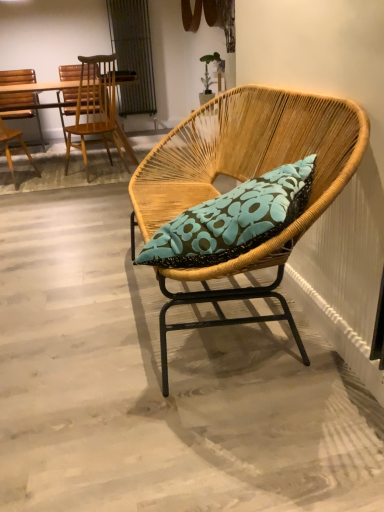
Find the location of `vacant space underneath woven wood chair at center, the 3th chair in the back-to-front sequence (from a real-world perspective)`. vacant space underneath woven wood chair at center, the 3th chair in the back-to-front sequence (from a real-world perspective) is located at coordinates (230, 353).